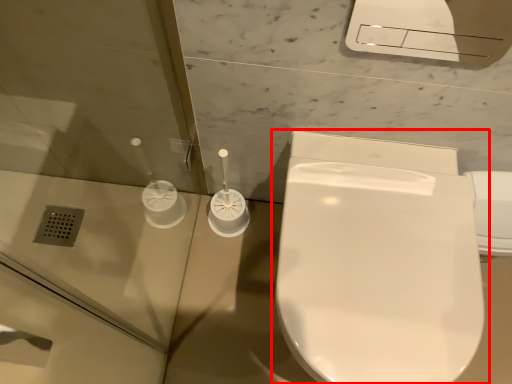
Question: Considering the relative positions of toilet (annotated by the red box) and screen door in the image provided, where is toilet (annotated by the red box) located with respect to the staircase?

Choices:
 (A) right
 (B) left

Answer: (A)